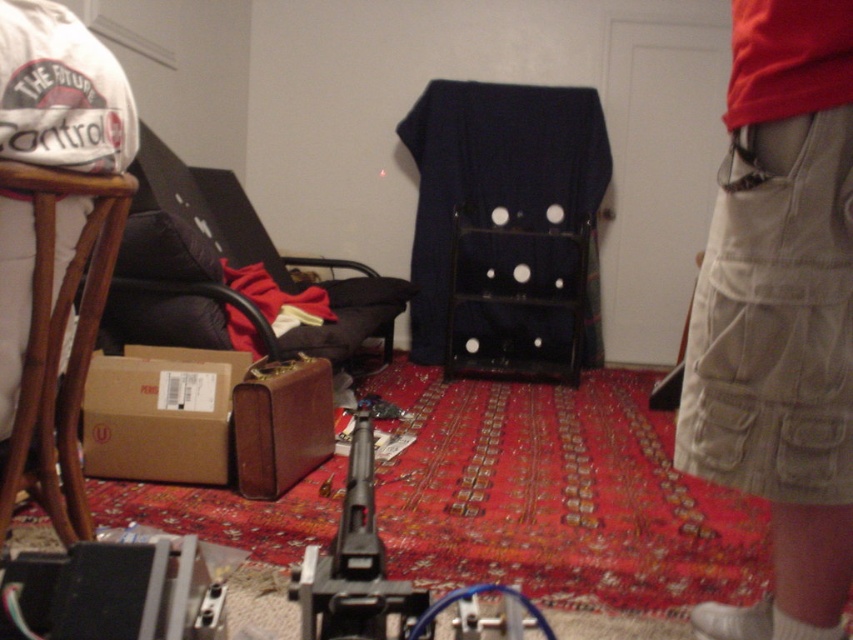
Describe the element at coordinates (780, 314) in the screenshot. I see `khaki cargo pants at right` at that location.

Is point (776, 236) more distant than point (193, 397)?

No, it is in front of (193, 397).

Locate an element on the screen. This screenshot has height=640, width=853. khaki cargo pants at right is located at coordinates (780, 314).

Does bamboo stool at left appear on the left side of black plastic gun at center?

Correct, you'll find bamboo stool at left to the left of black plastic gun at center.

The height and width of the screenshot is (640, 853). I want to click on bamboo stool at left, so click(59, 346).

Between point (125, 468) and point (338, 570), which one is positioned behind?

Point (125, 468)

Between brown cardboard box at lower left and black plastic gun at center, which one is positioned higher?

brown cardboard box at lower left is above.

Describe the element at coordinates (160, 413) in the screenshot. I see `brown cardboard box at lower left` at that location.

Identify the location of brown cardboard box at lower left. The width and height of the screenshot is (853, 640). (160, 413).